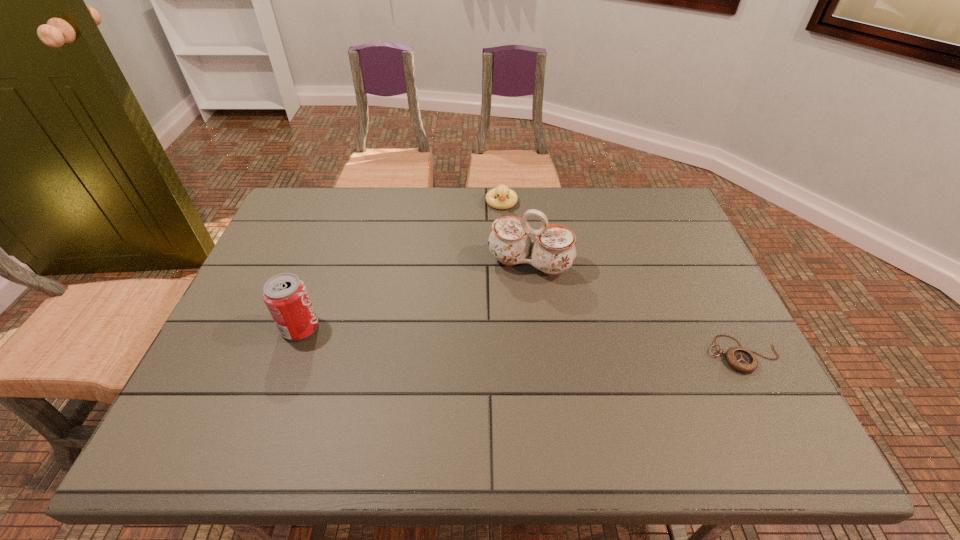
Identify the location of free space on the desktop that is between the leftmost object and the pocket watch and is positioned at the beak of the farthest object. Image resolution: width=960 pixels, height=540 pixels. (506, 340).

Find the location of a particular element. vacant space on the desktop that is between the third shortest object and the rightmost object and is positioned by the handle of the chinaware is located at coordinates (502, 340).